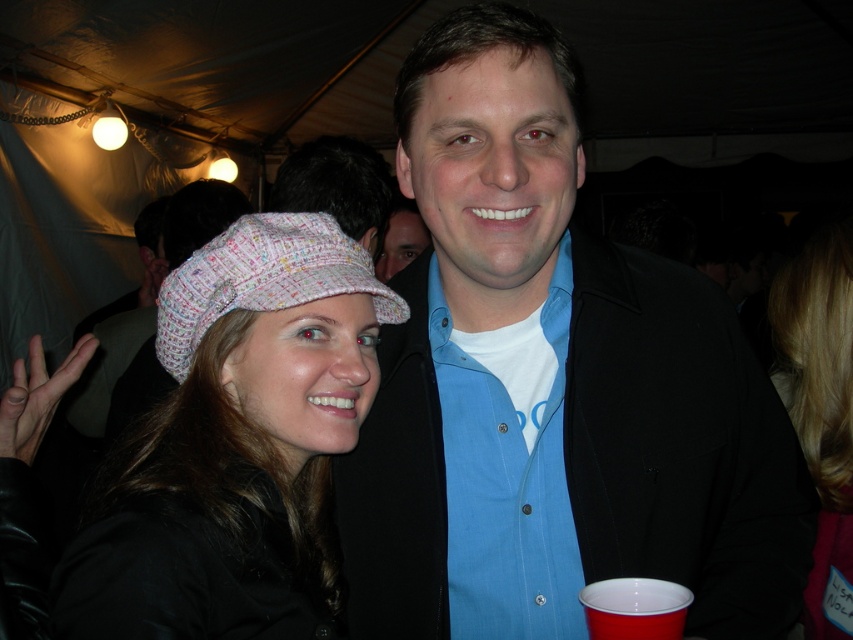
Question: Which object is closer to the camera taking this photo?

Choices:
 (A) textured knit hat at left
 (B) blue cotton shirt at center
 (C) knitted fabric hat at upper left

Answer: (A)

Question: Does textured knit hat at left have a greater width compared to knitted fabric hat at upper left?

Choices:
 (A) yes
 (B) no

Answer: (A)

Question: Which object appears farthest from the camera in this image?

Choices:
 (A) blonde hair at center
 (B) blue cotton shirt at center

Answer: (A)

Question: Does blonde hair at center have a greater width compared to red plastic cup at lower right?

Choices:
 (A) no
 (B) yes

Answer: (B)

Question: From the image, what is the correct spatial relationship of blue cotton shirt at center in relation to red plastic cup at lower right?

Choices:
 (A) right
 (B) left

Answer: (B)

Question: Which of the following is the farthest from the observer?

Choices:
 (A) (334, 186)
 (B) (582, 509)
 (C) (842, 394)
 (D) (270, 282)

Answer: (A)